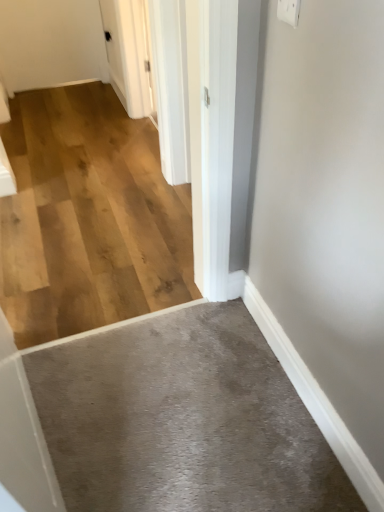
Question: From a real-world perspective, is gray carpet at lower center, the second concrete when ordered from top to bottom, physically located above or below natural wood flooring at center, the 2th concrete in the bottom-to-top sequence?

Choices:
 (A) below
 (B) above

Answer: (A)

Question: In the image, is gray carpet at lower center, which appears as the 1th concrete when ordered from the bottom, positioned in front of or behind natural wood flooring at center, the first concrete from the back?

Choices:
 (A) front
 (B) behind

Answer: (A)

Question: Estimate the real-world distances between objects in this image. Which object is closer to the gray carpet at lower center, the second concrete when ordered from top to bottom?

Choices:
 (A) white glossy door at upper center
 (B) white plastic electric outlet at upper right
 (C) natural wood flooring at center, which is counted as the first concrete, starting from the top

Answer: (C)

Question: Based on their relative distances, which object is nearer to the gray carpet at lower center, which appears as the 1th concrete when ordered from the bottom?

Choices:
 (A) white glossy door at upper center
 (B) white plastic electric outlet at upper right
 (C) natural wood flooring at center, positioned as the 2th concrete in front-to-back order

Answer: (C)